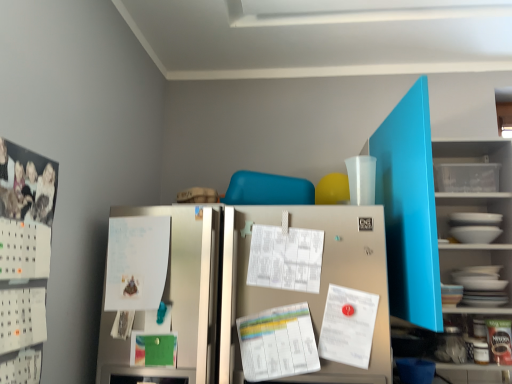
Question: Should I look upward or downward to see white paper at center, marked as the first paper in a right-to-left arrangement?

Choices:
 (A) up
 (B) down

Answer: (B)

Question: From the image's perspective, is matte blue bookshelf at upper right located above white paper at center, which appears as the 3th paper when viewed from the right?

Choices:
 (A) no
 (B) yes

Answer: (B)

Question: Is matte blue bookshelf at upper right facing towards white paper at center, which appears as the 3th paper when viewed from the right?

Choices:
 (A) no
 (B) yes

Answer: (A)

Question: Can you confirm if matte blue bookshelf at upper right is smaller than white paper at center, which appears as the 3th paper when viewed from the right?

Choices:
 (A) yes
 (B) no

Answer: (B)

Question: Is matte blue bookshelf at upper right bigger than white paper at center, which appears as the 3th paper when viewed from the right?

Choices:
 (A) yes
 (B) no

Answer: (A)

Question: From a real-world perspective, is matte blue bookshelf at upper right physically above white paper at center, which appears as the 3th paper when viewed from the right?

Choices:
 (A) no
 (B) yes

Answer: (B)

Question: Is the depth of matte blue bookshelf at upper right greater than that of white paper at center, which appears as the 3th paper when viewed from the right?

Choices:
 (A) no
 (B) yes

Answer: (A)

Question: Can you confirm if satin silver refrigerator at center is bigger than white paperboard at left?

Choices:
 (A) yes
 (B) no

Answer: (A)

Question: Considering the relative sizes of satin silver refrigerator at center and white paperboard at left in the image provided, is satin silver refrigerator at center shorter than white paperboard at left?

Choices:
 (A) yes
 (B) no

Answer: (B)

Question: Is satin silver refrigerator at center not close to white paperboard at left?

Choices:
 (A) yes
 (B) no

Answer: (B)

Question: Is satin silver refrigerator at center turned away from white paperboard at left?

Choices:
 (A) no
 (B) yes

Answer: (A)

Question: Is satin silver refrigerator at center positioned beyond the bounds of white paperboard at left?

Choices:
 (A) yes
 (B) no

Answer: (A)

Question: Are satin silver refrigerator at center and white paperboard at left making contact?

Choices:
 (A) yes
 (B) no

Answer: (B)

Question: Is satin silver refrigerator at center not near white paper at center, the 1th paper in the left-to-right sequence?

Choices:
 (A) no
 (B) yes

Answer: (A)